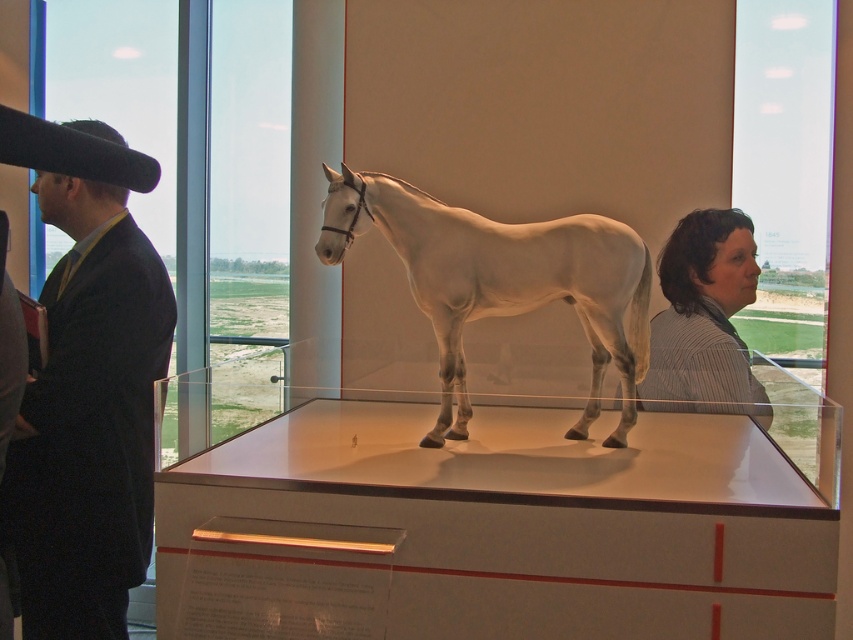
Question: Which point is farther to the camera?

Choices:
 (A) white glossy horse at center
 (B) striped fabric shirt at right

Answer: (B)

Question: Considering the relative positions of black suit at left and striped fabric shirt at right in the image provided, where is black suit at left located with respect to striped fabric shirt at right?

Choices:
 (A) right
 (B) left

Answer: (B)

Question: Does white glossy horse at center appear on the right side of striped fabric shirt at right?

Choices:
 (A) yes
 (B) no

Answer: (B)

Question: From the image, what is the correct spatial relationship of black suit at left in relation to white glossy horse at center?

Choices:
 (A) right
 (B) left

Answer: (B)

Question: Which object is closer to the camera taking this photo?

Choices:
 (A) striped fabric shirt at right
 (B) white glossy horse at center
 (C) black suit at left

Answer: (B)

Question: Which point appears closest to the camera in this image?

Choices:
 (A) (737, 234)
 (B) (346, 176)
 (C) (122, 401)

Answer: (B)